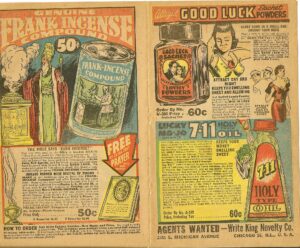
You are a GUI agent. You are given a task and a screenshot of the screen. Output one action in this format:
    pyautogui.click(x=<x>, y=<y>)
    Task: Click on the robe
    
    Given the screenshot: What is the action you would take?
    pyautogui.click(x=64, y=111)